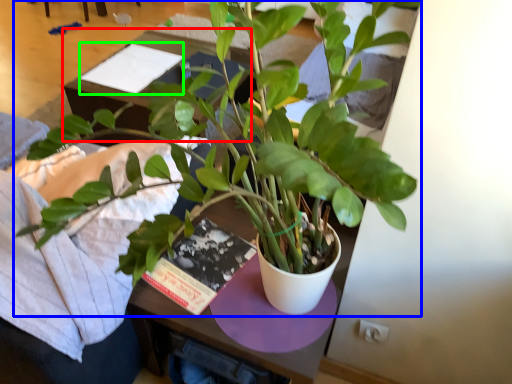
Question: Which object is positioned farthest from table (highlighted by a red box)? Select from houseplant (highlighted by a blue box) and book (highlighted by a green box).

Choices:
 (A) houseplant
 (B) book

Answer: (A)